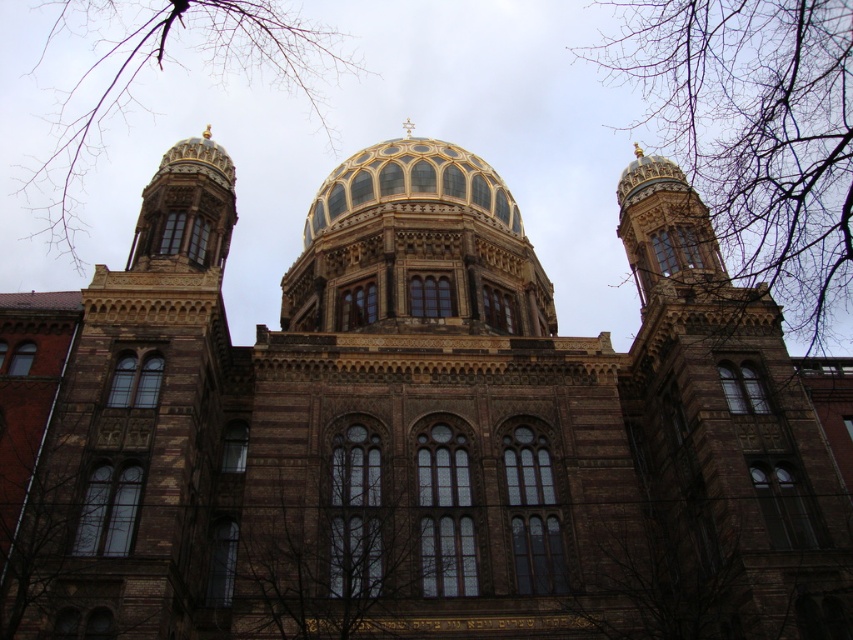
You are an architect analyzing the building structure. You notice the transparent glass windows at center and the bare branches at upper left. Which of these two elements is positioned higher up in the image?

The bare branches at upper left are positioned higher up in the image than the transparent glass windows at center.

You are standing in front of the grand building and want to determine the relative positions of two specific points marked on the structure. Which of the two points, point 1 at coordinates (631, 26) or point 2 at coordinates (497, 216), is closer to you?

Point 1 at coordinates (631, 26) is closer to you because it is further to the viewer than point 2 at coordinates (497, 216).